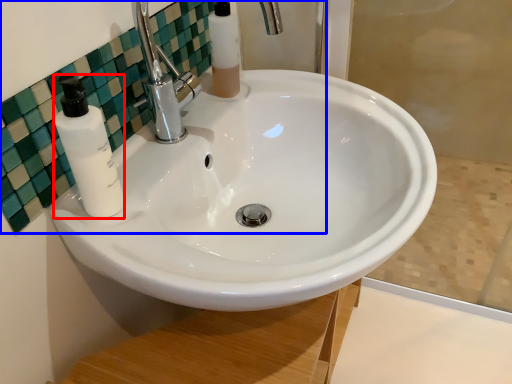
Question: Among these objects, which one is nearest to the camera, soap dispenser (highlighted by a red box) or mirror (highlighted by a blue box)?

Choices:
 (A) soap dispenser
 (B) mirror

Answer: (B)